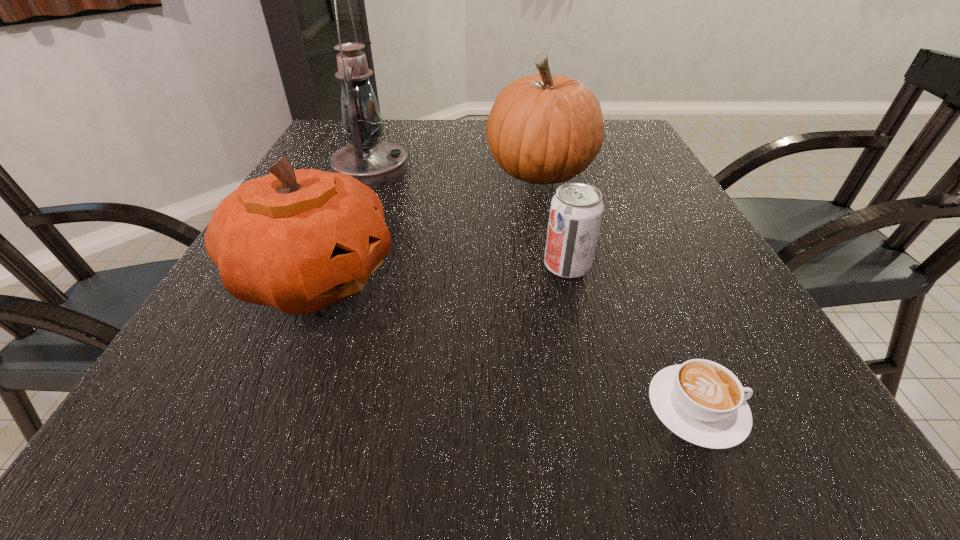
You are a GUI agent. You are given a task and a screenshot of the screen. Output one action in this format:
    pyautogui.click(x=<x>, y=<y>)
    Task: Click on the object that is at the right edge
    This screenshot has height=540, width=960.
    Given the screenshot: What is the action you would take?
    pyautogui.click(x=701, y=401)

Identify the location of object situated at the far left corner. This screenshot has width=960, height=540. (375, 163).

Find the location of `object that is at the near right corner`. object that is at the near right corner is located at coordinates (701, 401).

The height and width of the screenshot is (540, 960). Identify the location of free space at the far edge of the desktop. (487, 141).

Where is `vacant space at the near edge`? The width and height of the screenshot is (960, 540). vacant space at the near edge is located at coordinates (450, 415).

Image resolution: width=960 pixels, height=540 pixels. Find the location of `free space at the left edge of the desktop`. free space at the left edge of the desktop is located at coordinates (270, 331).

In the image, there is a desktop. In order to click on free region at the right edge in this screenshot , I will do `click(699, 339)`.

Where is `empty location between the farther pumpkin and the tallest object`? empty location between the farther pumpkin and the tallest object is located at coordinates (455, 172).

I want to click on vacant point located between the tallest object and the second tallest object, so click(x=455, y=172).

Locate an element on the screen. The image size is (960, 540). free space between the tallest object and the soda can is located at coordinates (468, 218).